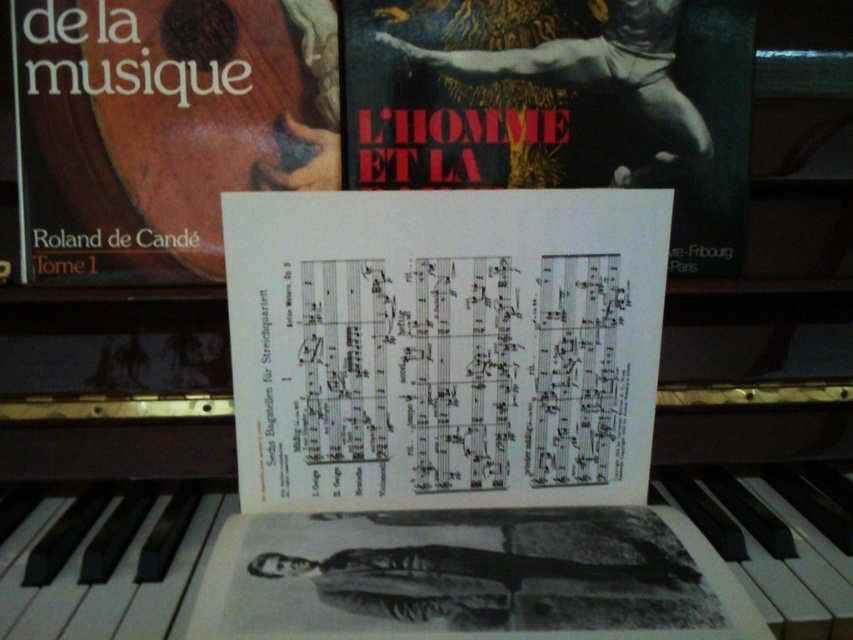
You are a musician preparing for a performance. You notice two white paper music sheets on the piano. Which one is closer to you, the white paper music sheet at center or the white paper music sheet at upper center?

The white paper music sheet at center is positioned under the white paper music sheet at upper center, so the one at upper center is closer to you.

From the picture: You are standing in front of the piano and want to place a small decorative item on the surface. There are two points marked on the piano surface at coordinates point (440, 202) and point (328, 22). Which point is closer to you where you can place the item?

Point (440, 202) is closer to the viewer than point (328, 22), so you can place the item there.